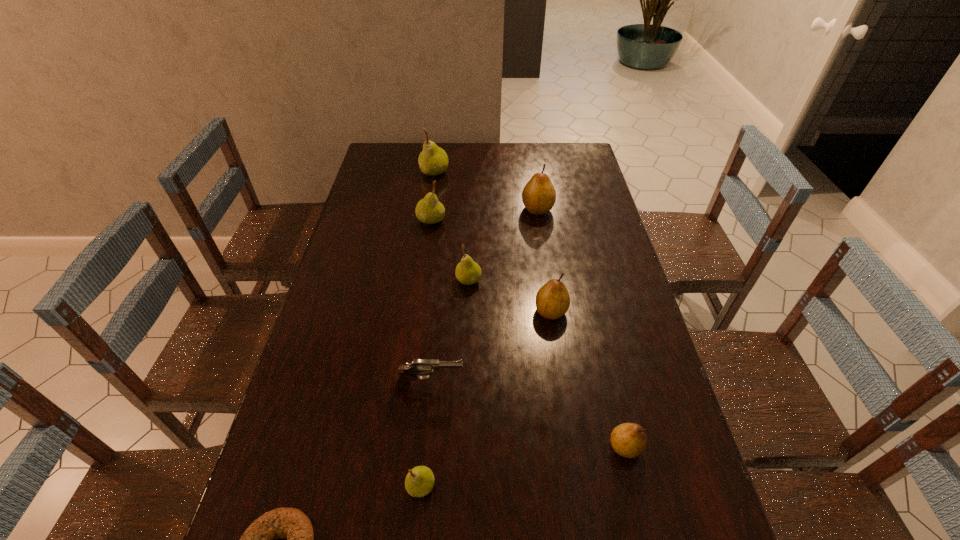
The height and width of the screenshot is (540, 960). What are the coordinates of `the smallest brown pear` in the screenshot? It's located at (629, 440).

At what (x,y) coordinates should I click in order to perform the action: click on the nearest brown pear. Please return your answer as a coordinate pair (x, y). Looking at the image, I should click on (629, 440).

What are the coordinates of `the smallest green pear` in the screenshot? It's located at (419, 482).

Locate an element on the screen. the nearest pear is located at coordinates (419, 482).

Locate an element on the screen. The height and width of the screenshot is (540, 960). free space located on the right of the tallest pear is located at coordinates (473, 172).

Find the location of a particular element. The width and height of the screenshot is (960, 540). free spot located 0.290m on the back of the farthest brown pear is located at coordinates (530, 159).

This screenshot has height=540, width=960. I want to click on free space located on the left of the second farthest green pear, so click(391, 220).

Image resolution: width=960 pixels, height=540 pixels. Identify the location of vacant space situated 0.050m on the front of the third nearest pear. (555, 339).

The height and width of the screenshot is (540, 960). I want to click on free space located on the back of the rightmost green pear, so click(x=469, y=240).

Locate an element on the screen. Image resolution: width=960 pixels, height=540 pixels. vacant area situated 0.290m at the barrel of the gray pistol is located at coordinates (581, 386).